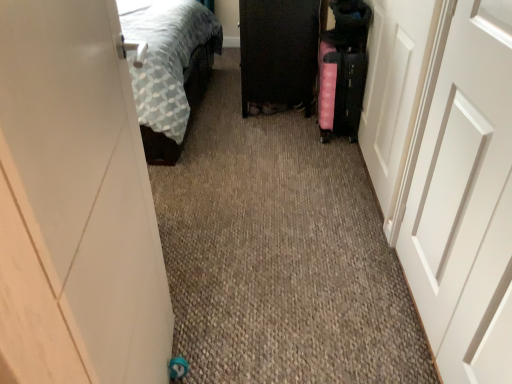
Where is `free space between black glossy cabinet at center and white matte door at right, placed as the 2th door when sorted from left to right`? Image resolution: width=512 pixels, height=384 pixels. free space between black glossy cabinet at center and white matte door at right, placed as the 2th door when sorted from left to right is located at coordinates (324, 199).